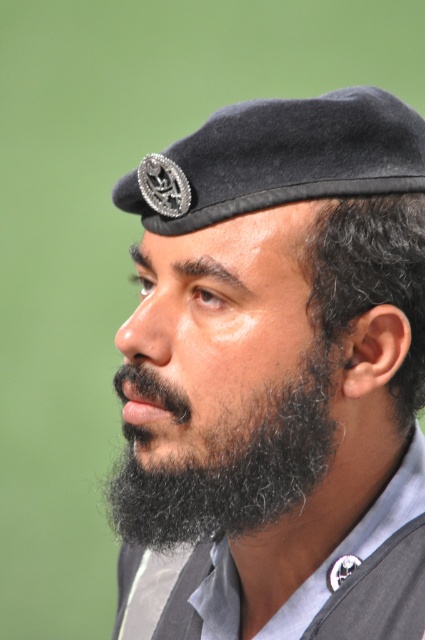
Question: Does black felt beret at upper center have a larger size compared to dark curly hair at ear?

Choices:
 (A) no
 (B) yes

Answer: (B)

Question: Estimate the real-world distances between objects in this image. Which object is farther from the black felt beret at upper center?

Choices:
 (A) black curly beard at lower left
 (B) black felt beret at center

Answer: (A)

Question: Which of the following is the closest to the observer?

Choices:
 (A) black felt beret at upper center
 (B) black curly beard at lower left
 (C) black felt beret at center

Answer: (A)

Question: Does black felt beret at upper center have a lesser width compared to dark curly hair at ear?

Choices:
 (A) yes
 (B) no

Answer: (B)

Question: Which of the following is the farthest from the observer?

Choices:
 (A) (362, 205)
 (B) (200, 541)

Answer: (B)

Question: Where is black felt beret at upper center located in relation to black curly beard at lower left in the image?

Choices:
 (A) right
 (B) left

Answer: (A)